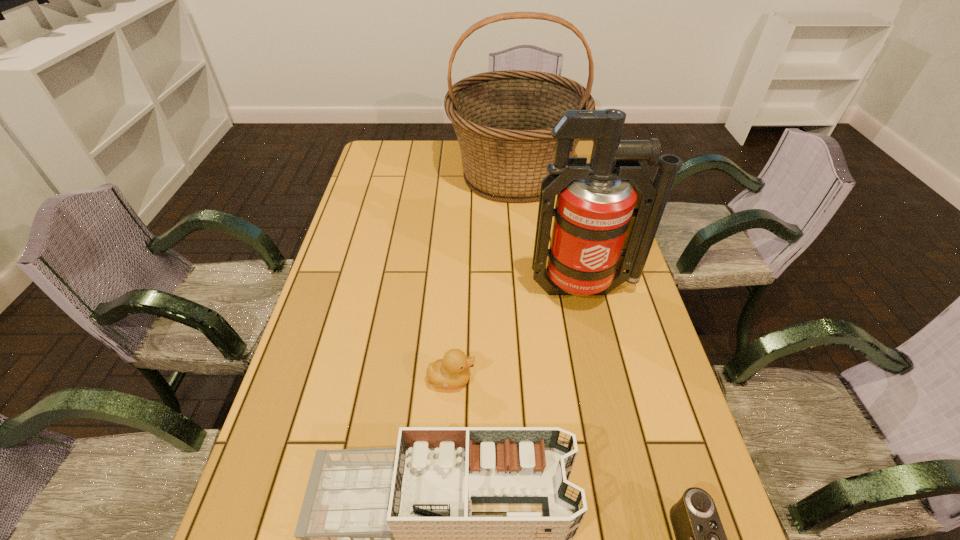
Image resolution: width=960 pixels, height=540 pixels. Identify the location of vacant space at the left edge. (363, 340).

Identify the location of vacant space at the right edge. (671, 450).

In the image, there is a desktop. What are the coordinates of `vacant space at the far left corner` in the screenshot? It's located at (377, 143).

The height and width of the screenshot is (540, 960). Identify the location of free space at the far right corner of the desktop. (581, 146).

This screenshot has height=540, width=960. What are the coordinates of `free spot between the duckling and the basket` in the screenshot? It's located at tap(483, 276).

You are a GUI agent. You are given a task and a screenshot of the screen. Output one action in this format:
    pyautogui.click(x=<x>, y=<y>)
    Task: Click on the vacant point located between the duckling and the basket
    The height and width of the screenshot is (540, 960).
    Given the screenshot: What is the action you would take?
    pyautogui.click(x=483, y=276)

This screenshot has width=960, height=540. Find the location of `unoccupied position between the basket and the third farthest object`. unoccupied position between the basket and the third farthest object is located at coordinates (483, 276).

You are a GUI agent. You are given a task and a screenshot of the screen. Output one action in this format:
    pyautogui.click(x=<x>, y=<y>)
    Task: Click on the third closest object to the dollhouse
    
    Given the screenshot: What is the action you would take?
    pyautogui.click(x=602, y=225)

The height and width of the screenshot is (540, 960). I want to click on object that is the second closest to the fourth nearest object, so click(503, 120).

Locate an element on the screen. Image resolution: width=960 pixels, height=540 pixels. free location that satisfies the following two spatial constraints: 1. on the front label side of the fire extinguisher; 2. facing forward on the duckling is located at coordinates (605, 379).